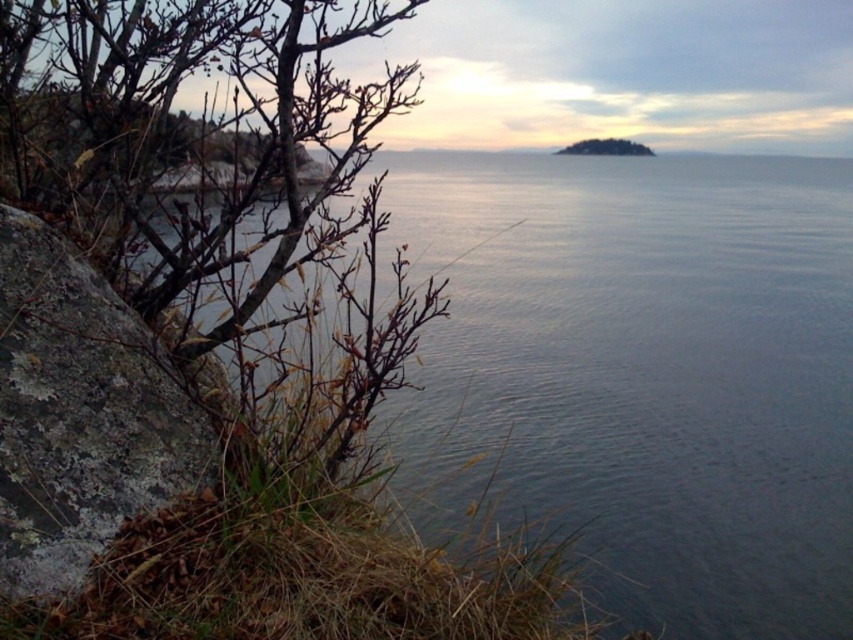
Does point (816, 348) come closer to viewer compared to point (271, 154)?

No, (816, 348) is further to viewer.

Between smooth blue water at center and brown bark tree at left, which one has less height?

brown bark tree at left

Does point (781, 257) come behind point (167, 17)?

That is True.

At what (x,y) coordinates should I click in order to perform the action: click on smooth blue water at center. Please return your answer as a coordinate pair (x, y). This screenshot has height=640, width=853. Looking at the image, I should click on (639, 374).

Which is below, brown bark tree at left or lichen-covered rock at left?

lichen-covered rock at left

Can you confirm if brown bark tree at left is thinner than lichen-covered rock at left?

No, brown bark tree at left is not thinner than lichen-covered rock at left.

Is point (20, 72) more distant than point (54, 269)?

Yes, point (20, 72) is farther from viewer.

You are a GUI agent. You are given a task and a screenshot of the screen. Output one action in this format:
    pyautogui.click(x=<x>, y=<y>)
    Task: Click on the brown bark tree at left
    This screenshot has height=640, width=853.
    Given the screenshot: What is the action you would take?
    pyautogui.click(x=202, y=125)

Does brown bark tree at left appear on the right side of green leafy island at center?

No, brown bark tree at left is not to the right of green leafy island at center.

Who is higher up, brown bark tree at left or green leafy island at center?

green leafy island at center is higher up.

Is point (219, 4) positioned after point (601, 152)?

No.

Image resolution: width=853 pixels, height=640 pixels. What are the coordinates of `brown bark tree at left` in the screenshot? It's located at (202, 125).